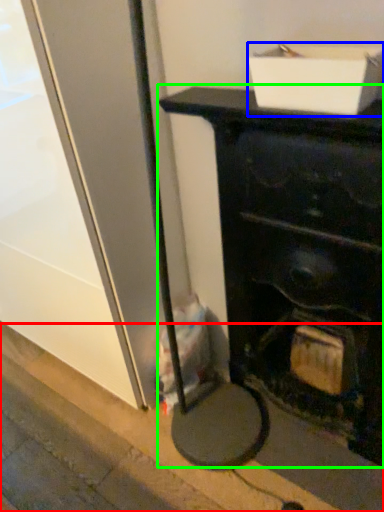
Question: Estimate the real-world distances between objects in this image. Which object is closer to pavement (highlighted by a red box), cardboard box (highlighted by a blue box) or furniture (highlighted by a green box)?

Choices:
 (A) cardboard box
 (B) furniture

Answer: (B)